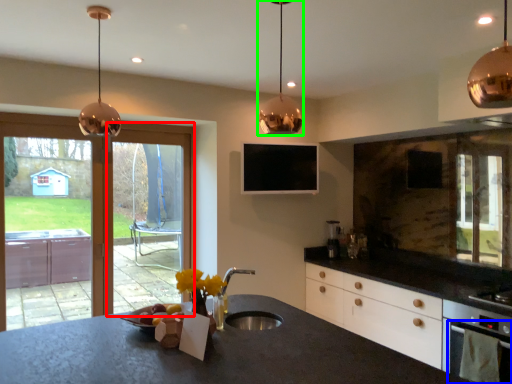
Question: Which object is the closest to the screen door (highlighted by a red box)? Choose among these: oven (highlighted by a blue box) or lamp (highlighted by a green box).

Choices:
 (A) oven
 (B) lamp

Answer: (A)